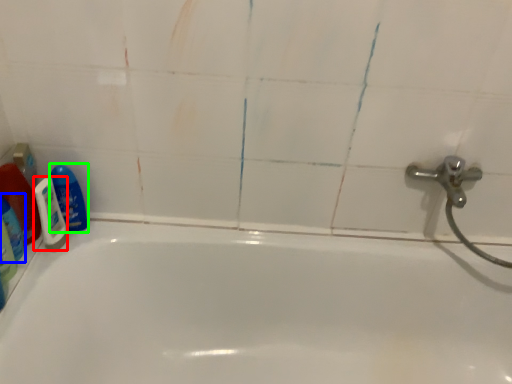
Question: Estimate the real-world distances between objects in this image. Which object is farther from shaving cream (highlighted by a red box), cleaning product (highlighted by a blue box) or cleaning product (highlighted by a green box)?

Choices:
 (A) cleaning product
 (B) cleaning product

Answer: (A)